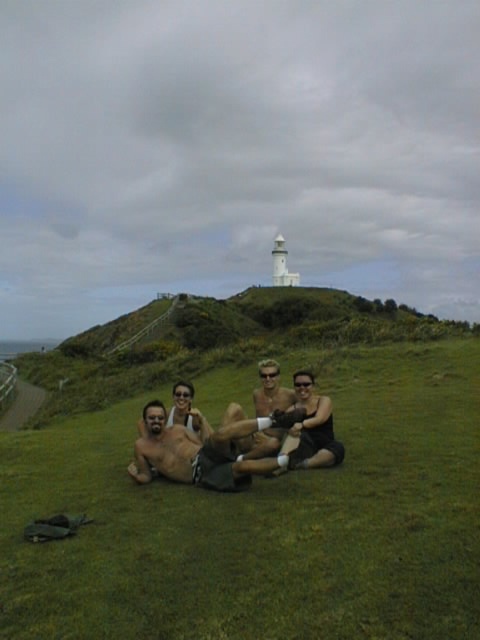
You are standing on the green grassy at center and want to reach the white lighthouse on the hill. Which direction should you walk to get closer to the green grassy hillside at upper center where the lighthouse is located?

You should walk towards the green grassy hillside at upper center because it is positioned above the green grassy at center, so moving upward in that direction will bring you closer to the lighthouse.

You are a photographer trying to capture a clear shot of both the shiny metallic shorts at center and the black fabric shorts at center. Based on their positions, which one is closer to the camera?

The shiny metallic shorts at center is located below the black fabric shorts at center, so the shiny metallic shorts at center is closer to the camera.